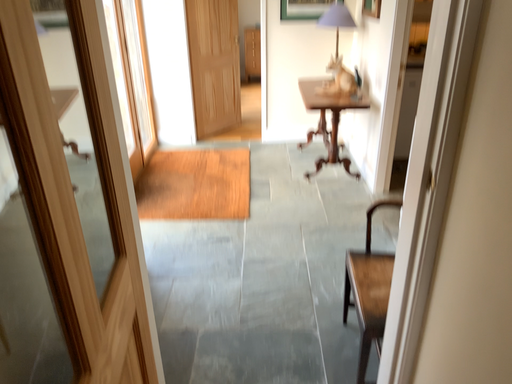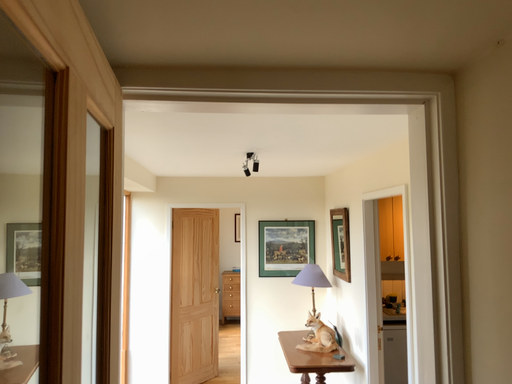
Question: How did the camera likely rotate when shooting the video?

Choices:
 (A) rotated downward
 (B) rotated upward

Answer: (B)